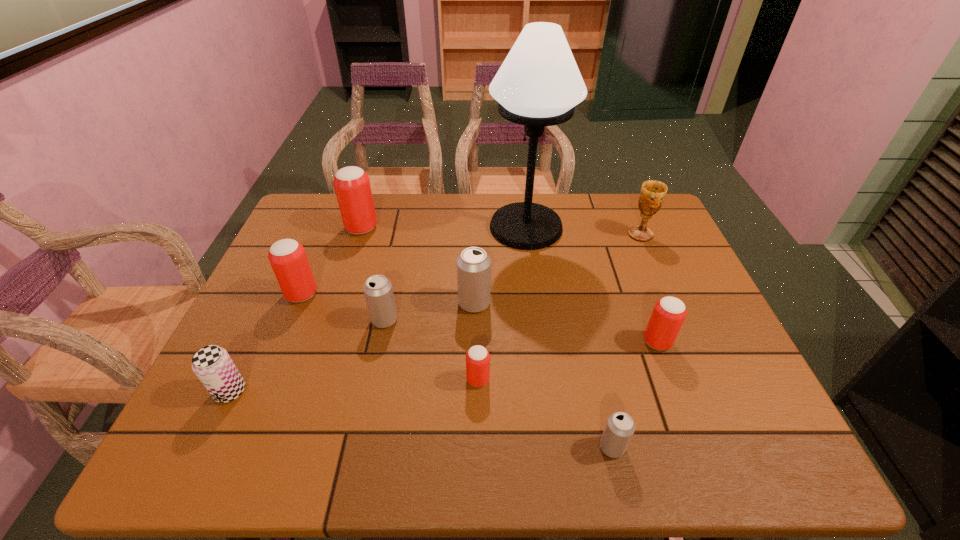
Locate an element on the screen. The width and height of the screenshot is (960, 540). vacant space located on the left of the third nearest red beer can is located at coordinates (256, 294).

At what (x,y) coordinates should I click in order to perform the action: click on free location located 0.140m on the front of the biggest white beer can. Please return your answer as a coordinate pair (x, y). The width and height of the screenshot is (960, 540). Looking at the image, I should click on (473, 360).

In order to click on vacant position located 0.230m on the left of the rightmost red beer can in this screenshot , I will do `click(548, 342)`.

Where is `free spot located 0.200m on the right of the leftmost white beer can`? This screenshot has width=960, height=540. free spot located 0.200m on the right of the leftmost white beer can is located at coordinates (477, 320).

Where is `vacant space located on the right of the purple beer can`? The width and height of the screenshot is (960, 540). vacant space located on the right of the purple beer can is located at coordinates (337, 392).

Identify the location of free space located on the front of the smallest red beer can. Image resolution: width=960 pixels, height=540 pixels. pos(478,432).

Locate an element on the screen. The width and height of the screenshot is (960, 540). free space located 0.150m on the right of the nearest object is located at coordinates (701, 447).

Where is `table lamp that is at the far edge`? The height and width of the screenshot is (540, 960). table lamp that is at the far edge is located at coordinates (539, 84).

Locate an element on the screen. beer can situated at the far edge is located at coordinates (352, 186).

Where is `chalice at the far edge`? chalice at the far edge is located at coordinates (652, 194).